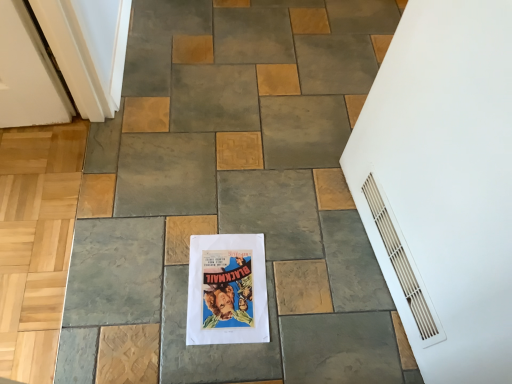
Where is `free point above matte paper poster at center (from a real-world perspective)`? This screenshot has height=384, width=512. free point above matte paper poster at center (from a real-world perspective) is located at coordinates (228, 290).